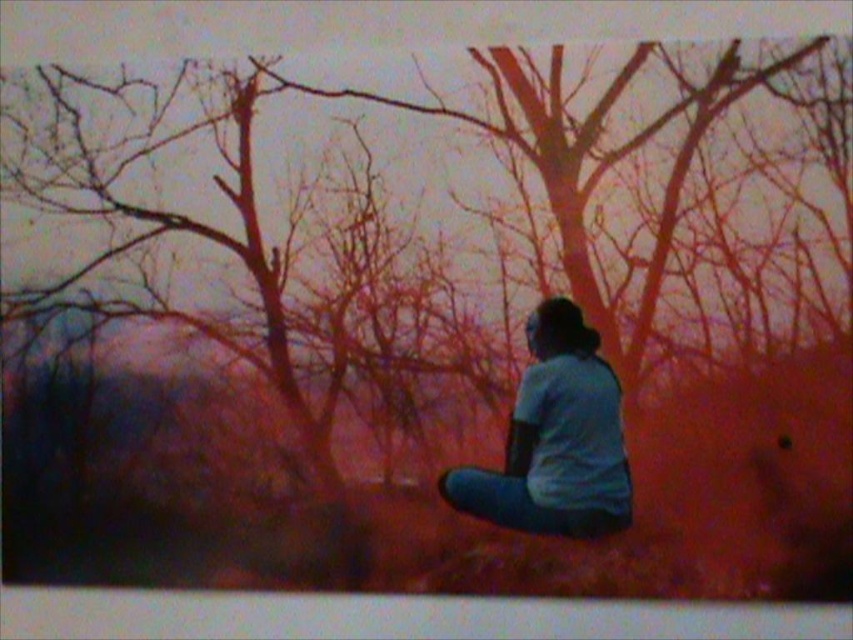
Question: Does smooth bark tree at center appear on the right side of light blue fabric shirt at center?

Choices:
 (A) no
 (B) yes

Answer: (A)

Question: Which of the following is the closest to the observer?

Choices:
 (A) (627, 352)
 (B) (589, 500)

Answer: (B)

Question: Which point is farther to the camera?

Choices:
 (A) (618, 412)
 (B) (253, 211)

Answer: (B)

Question: Is smooth bark tree at center bigger than light blue fabric shirt at center?

Choices:
 (A) no
 (B) yes

Answer: (B)

Question: Can you confirm if smooth bark tree at center is wider than light blue fabric shirt at center?

Choices:
 (A) no
 (B) yes

Answer: (B)